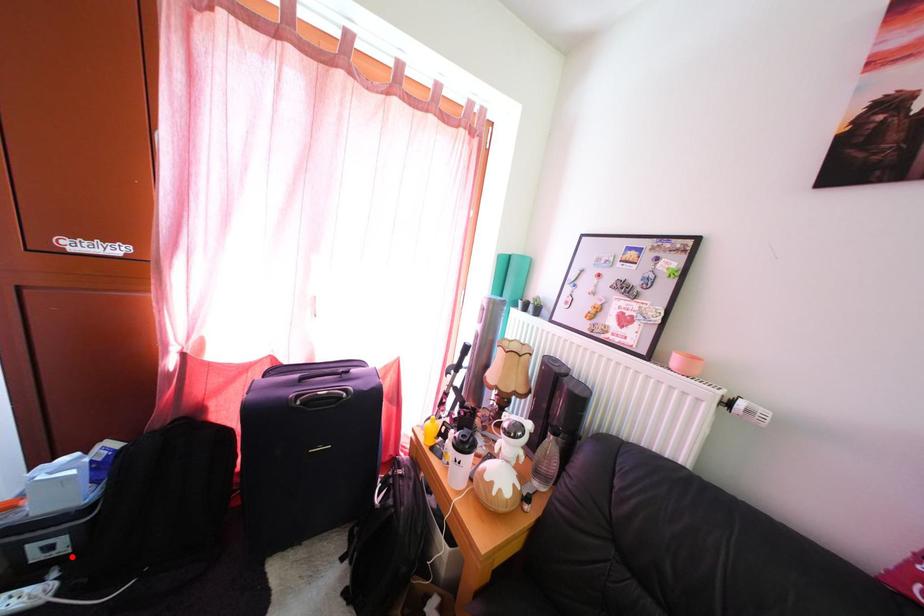
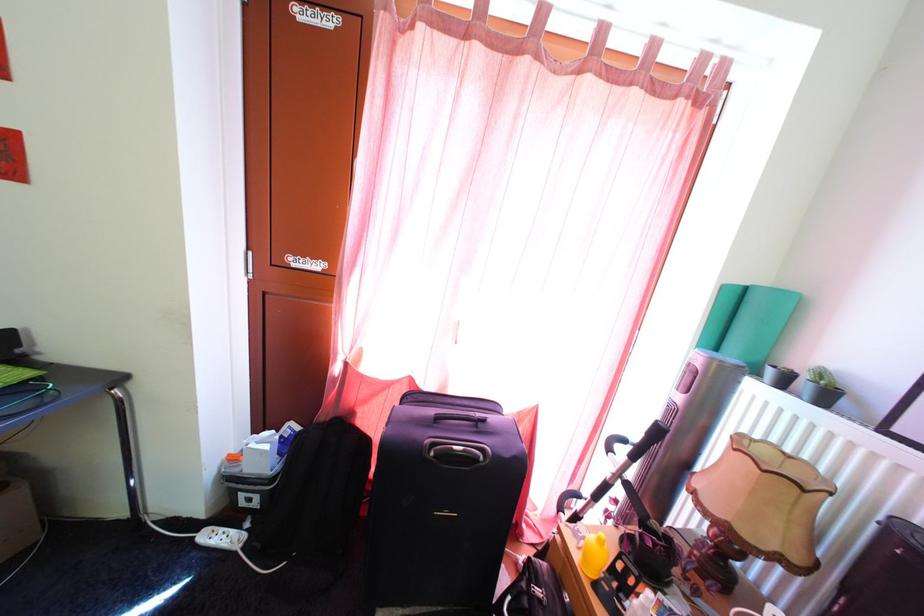
Locate, in the second image, the point that corresponds to the highlighted location in the first image.

(264, 512)